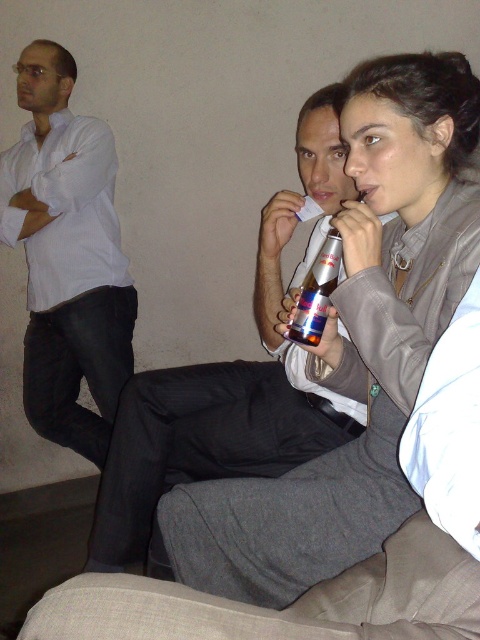
You are a delivery robot that is 0.5 meters wide. You need to move from the white shirt at left to the red metallic can at center. Is there enough space for you to pass through the area between them?

The distance between the white shirt at left and the red metallic can at center is 1.40 meters. Since the robot is 0.5 meters wide, there is sufficient space for it to pass through the 1.40 meter gap.

You are standing in the room and want to hand a document to the person wearing the dark gray suit at center. Which direction should you move to reach them first, considering their position relative to the white shirt at left?

The dark gray suit at center is located below the white shirt at left, so you should move downward from the white shirt at left to reach the dark gray suit at center first.